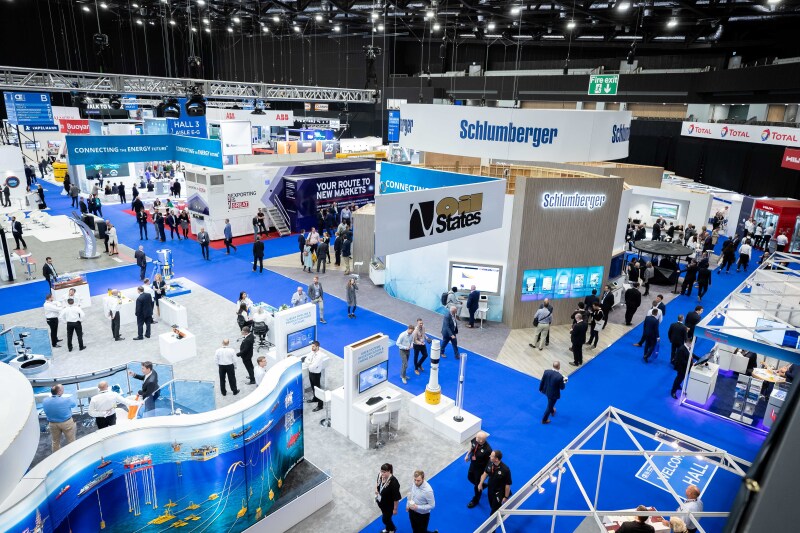
Where is `convention booth`? This screenshot has width=800, height=533. convention booth is located at coordinates (130, 171), (632, 205).